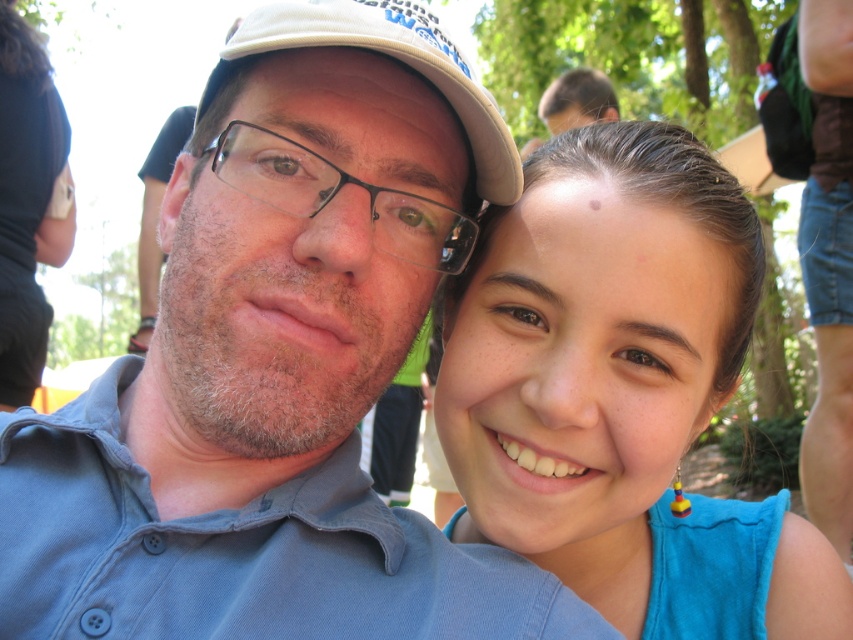
Question: Is blue fabric at upper right below white fabric cap at upper center?

Choices:
 (A) no
 (B) yes

Answer: (B)

Question: Where is blue fabric at upper right located in relation to white fabric cap at upper center in the image?

Choices:
 (A) left
 (B) right

Answer: (B)

Question: Which object appears farthest from the camera in this image?

Choices:
 (A) blue fabric at upper right
 (B) white fabric cap at upper center

Answer: (A)

Question: Considering the real-world distances, which object is farthest from the white fabric cap at upper center?

Choices:
 (A) blue fabric at upper right
 (B) blue denim shirt at center

Answer: (A)

Question: Does blue denim shirt at center appear on the right side of blue fabric at upper right?

Choices:
 (A) yes
 (B) no

Answer: (B)

Question: Considering the real-world distances, which object is farthest from the blue fabric at upper right?

Choices:
 (A) white fabric cap at upper center
 (B) blue denim shirt at center

Answer: (A)